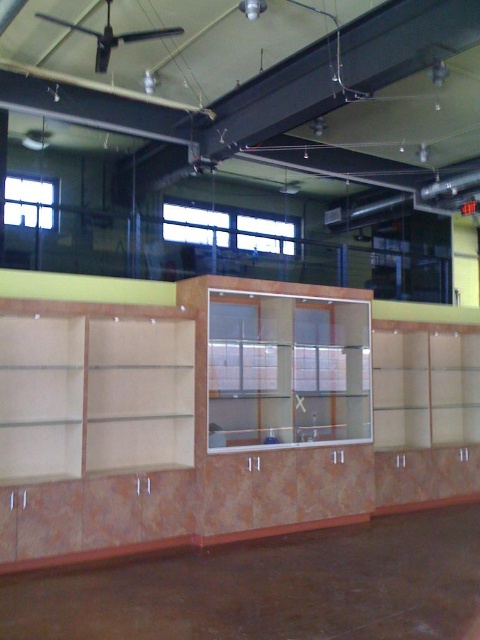
Question: Is light brown marble bookshelf at center positioned at the back of clear glass shelf at center?

Choices:
 (A) yes
 (B) no

Answer: (B)

Question: Which object appears closest to the camera in this image?

Choices:
 (A) clear glass shelf at center
 (B) light brown marble bookshelf at center

Answer: (B)

Question: Which object is farther from the camera taking this photo?

Choices:
 (A) matte wood shelf at center
 (B) clear glass shelf at center

Answer: (A)

Question: Is light brown marble bookshelf at center to the right of matte wood shelf at center from the viewer's perspective?

Choices:
 (A) no
 (B) yes

Answer: (A)

Question: Which object is the farthest from the light brown marble bookshelf at center?

Choices:
 (A) clear glass shelf at center
 (B) matte wood shelf at center

Answer: (B)

Question: In this image, where is light brown marble bookshelf at center located relative to clear glass shelf at center?

Choices:
 (A) above
 (B) below

Answer: (B)